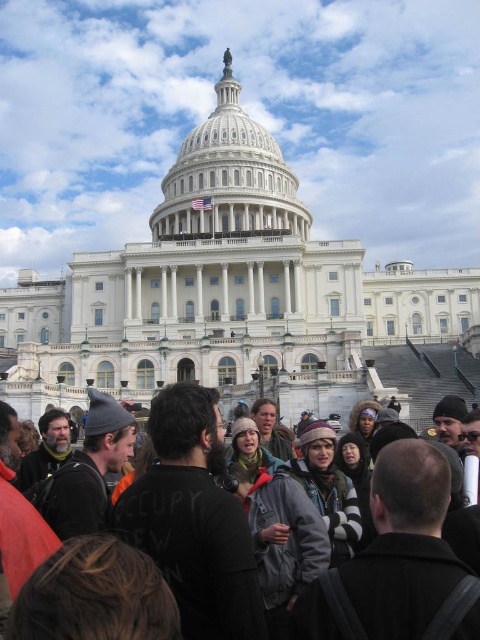
You are standing in front of the United States Capitol building and notice two objects in the scene. One is the dark gray knit hat at center and the other is the white marble dome at center. Which object is closer to you?

The dark gray knit hat at center is closer to the viewer than the white marble dome at center.

You are standing in front of the United States Capitol building and want to take a photo of the Capitol dome. There is a specific point at coordinates point [189,460] that you need to frame in your shot. Considering the distance between you and this point, can you estimate how far you need to move forward or backward to ensure the point is centered in your camera view?

The distance between you and the point [189,460] is 28.27 meters. To center this point in your camera view, you would need to adjust your position based on your camera lens focal length and sensor size, but the direct distance to the point is 28.27 meters.